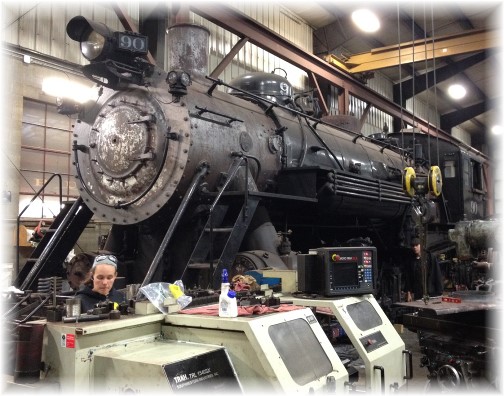
I want to click on light, so click(379, 32).